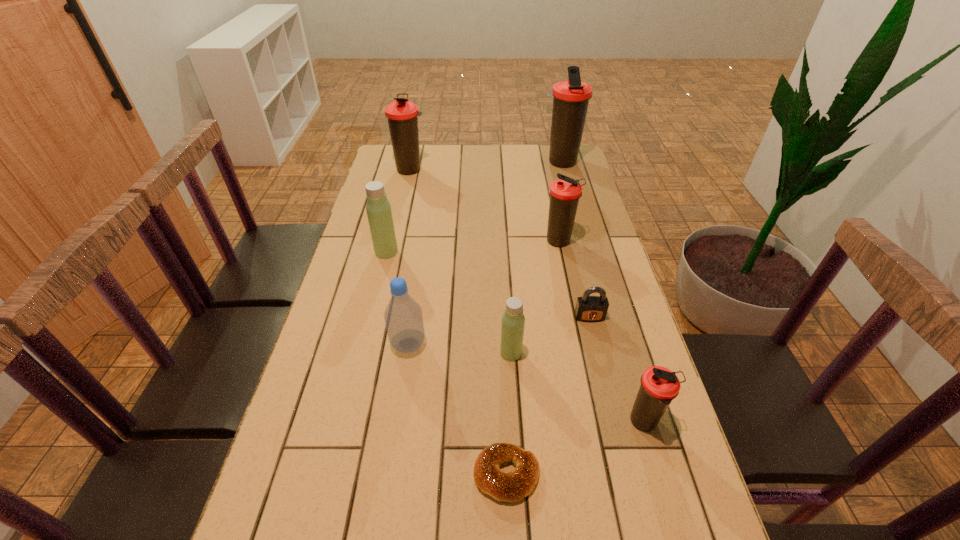
This screenshot has width=960, height=540. I want to click on vacant space at the right edge of the desktop, so click(x=588, y=213).

The width and height of the screenshot is (960, 540). I want to click on free space at the far right corner, so click(583, 170).

You are a GUI agent. You are given a task and a screenshot of the screen. Output one action in this format:
    pyautogui.click(x=<x>, y=<y>)
    Task: Click on the vacant space that's between the second smallest brown thermos bottle and the smallest brown thermos bottle
    The image size is (960, 540).
    Given the screenshot: What is the action you would take?
    pyautogui.click(x=602, y=332)

You are a GUI agent. You are given a task and a screenshot of the screen. Output one action in this format:
    pyautogui.click(x=<x>, y=<y>)
    Task: Click on the unoccupied area between the biggest brown thermos bottle and the nearer light thermos bottle
    
    Given the screenshot: What is the action you would take?
    pyautogui.click(x=536, y=258)

Locate an element on the screen. blank region between the second nearest object and the padlock is located at coordinates (617, 370).

Where is `free space between the farther light thermos bottle and the gray padlock`? free space between the farther light thermos bottle and the gray padlock is located at coordinates (488, 285).

I want to click on vacant point located between the nearest brown thermos bottle and the nearer light thermos bottle, so click(578, 388).

Find the location of a particular element. unoccupied position between the bigger light thermos bottle and the third thermos bottle from left to right is located at coordinates (448, 302).

Locate an element on the screen. This screenshot has height=540, width=960. free space between the shortest object and the tallest object is located at coordinates (534, 319).

Select which object is the second closest to the shortest object. Please provide its 2D coordinates. Your answer should be formatted as a tuple, i.e. [(x, y)], where the tuple contains the x and y coordinates of a point satisfying the conditions above.

[(513, 320)]